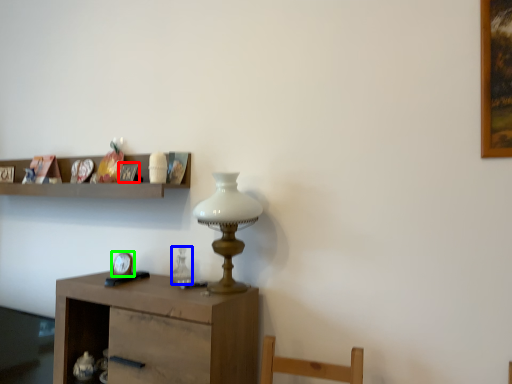
Question: Based on their relative distances, which object is nearer to picture frame (highlighted by a red box)? Choose from glass vase (highlighted by a blue box) and clock (highlighted by a green box).

Choices:
 (A) glass vase
 (B) clock

Answer: (B)